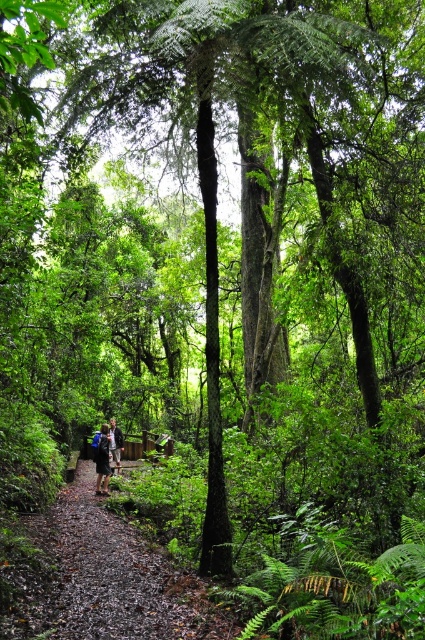
Does brown dirt path at center have a greater width compared to blue fabric backpack at center?

Yes, brown dirt path at center is wider than blue fabric backpack at center.

What do you see at coordinates (107, 579) in the screenshot?
I see `brown dirt path at center` at bounding box center [107, 579].

The height and width of the screenshot is (640, 425). Identify the location of brown dirt path at center. (107, 579).

Can you confirm if blue fabric backpack at center is smaller than dark blue jacket at center?

Indeed, blue fabric backpack at center has a smaller size compared to dark blue jacket at center.

Is the position of blue fabric backpack at center less distant than that of dark blue jacket at center?

Yes, it is in front of dark blue jacket at center.

Is point (102, 472) farther from camera compared to point (116, 460)?

No.

Locate an element on the screen. Image resolution: width=425 pixels, height=640 pixels. blue fabric backpack at center is located at coordinates (104, 452).

Between brown dirt path at center and dark blue jacket at center, which one is positioned higher?

brown dirt path at center is higher up.

Between brown dirt path at center and dark blue jacket at center, which one appears on the left side from the viewer's perspective?

dark blue jacket at center is more to the left.

Is point (226, 630) farther from camera compared to point (116, 444)?

That is False.

Locate an element on the screen. This screenshot has width=425, height=640. brown dirt path at center is located at coordinates (107, 579).